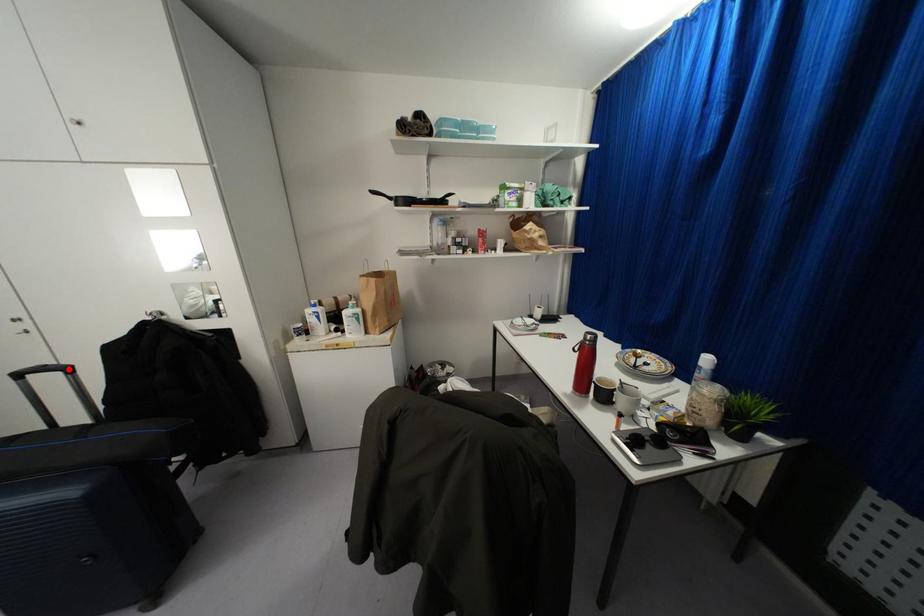
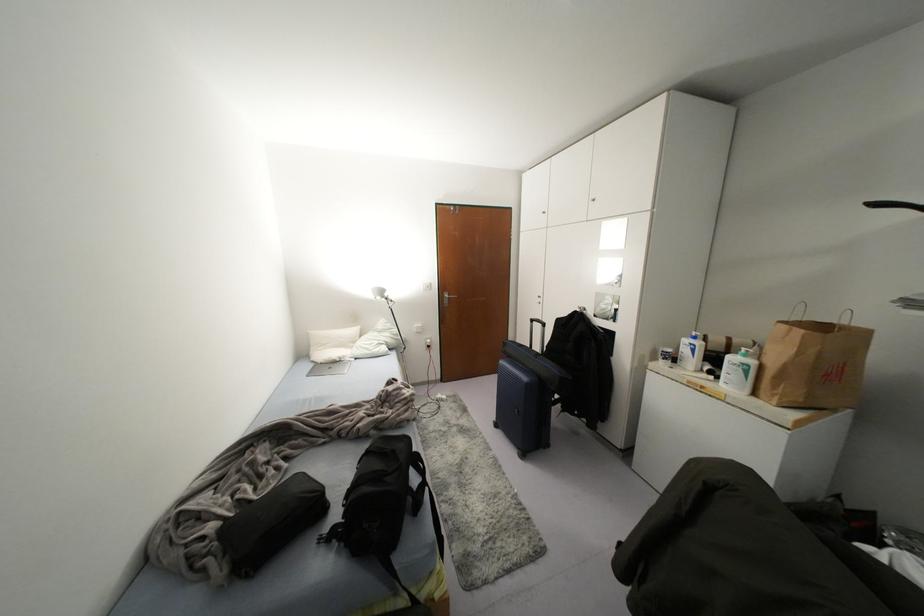
Question: I am providing you with two images of the same scene from different viewpoints. A red point is marked on the first image. At the location where the point appears in image 1, is it still visible in image 2?

Choices:
 (A) Yes
 (B) No

Answer: (A)